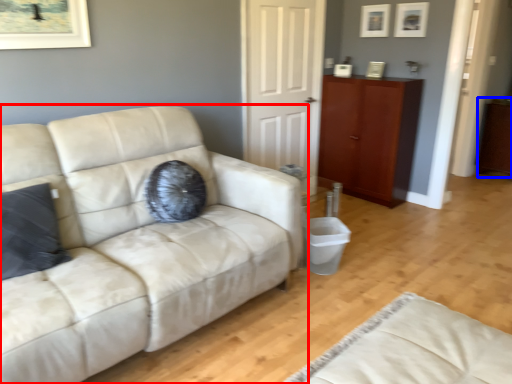
Question: Which object is further to the camera taking this photo, studio couch (highlighted by a red box) or dresser (highlighted by a blue box)?

Choices:
 (A) studio couch
 (B) dresser

Answer: (B)